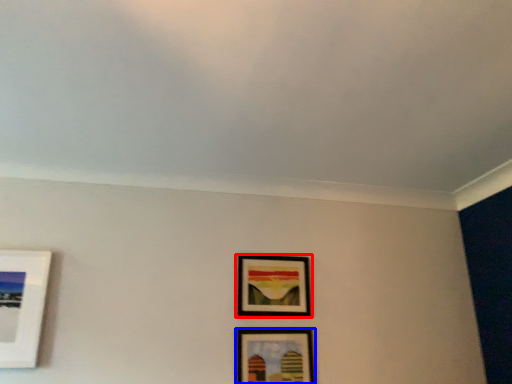
Question: Which point is further to the camera, picture frame (highlighted by a red box) or picture frame (highlighted by a blue box)?

Choices:
 (A) picture frame
 (B) picture frame

Answer: (A)